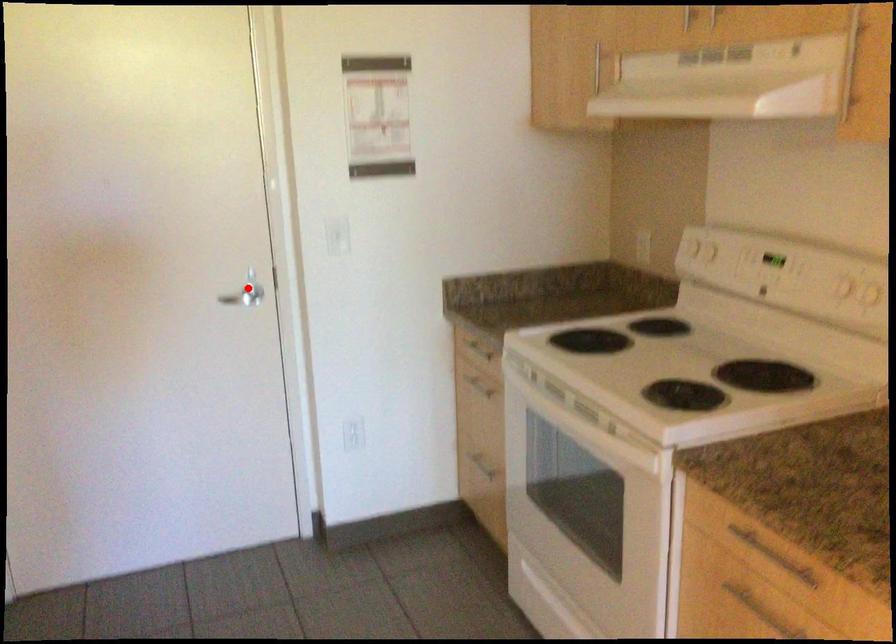
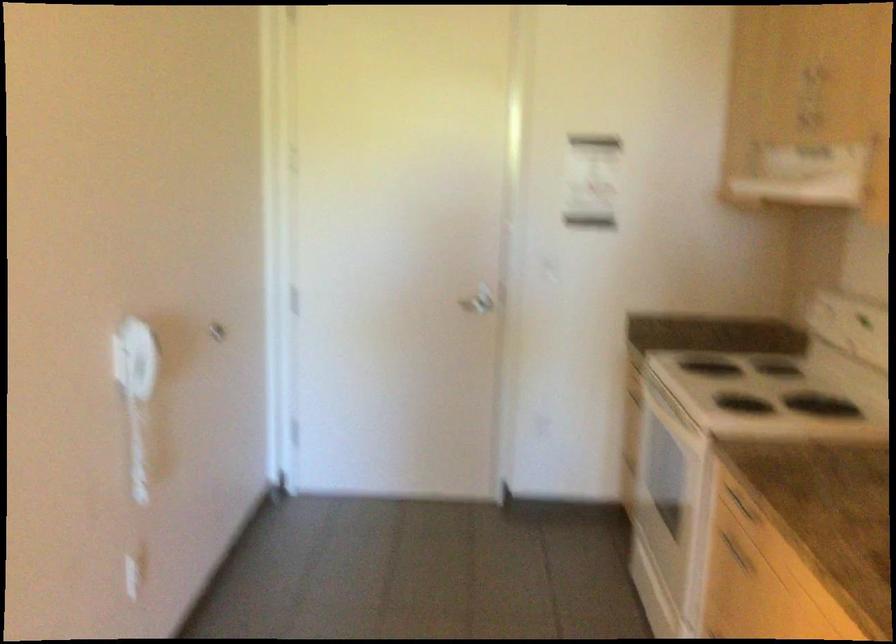
Where in the second image is the point corresponding to the highlighted location from the first image?

(478, 301)